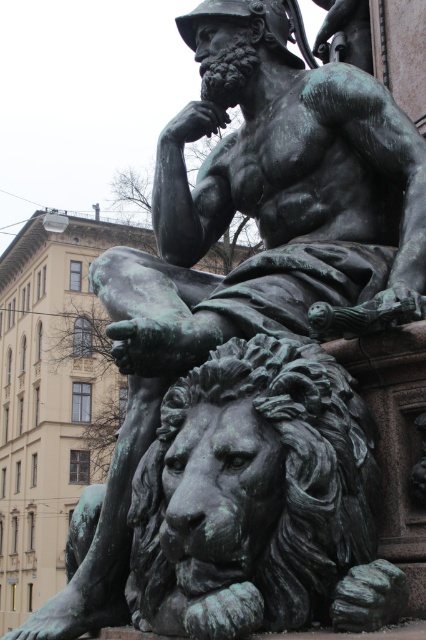
Measure the distance between green patina statue at center and green patina lion at lower left.

green patina statue at center and green patina lion at lower left are 3.65 meters apart.

Is point (337, 179) closer to viewer compared to point (371, 481)?

No, (337, 179) is further to viewer.

Is point (365, 257) more distant than point (160, 476)?

Yes, it is behind point (160, 476).

I want to click on green patina statue at center, so click(x=270, y=202).